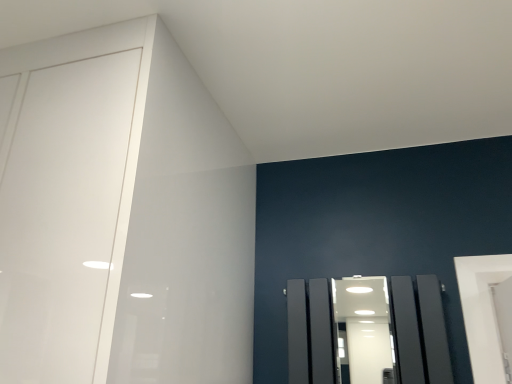
The width and height of the screenshot is (512, 384). What do you see at coordinates (365, 326) in the screenshot?
I see `white glossy mirror at upper center` at bounding box center [365, 326].

Image resolution: width=512 pixels, height=384 pixels. I want to click on white glossy mirror at upper center, so click(365, 326).

Where is `white glossy mirror at upper center`? white glossy mirror at upper center is located at coordinates (365, 326).